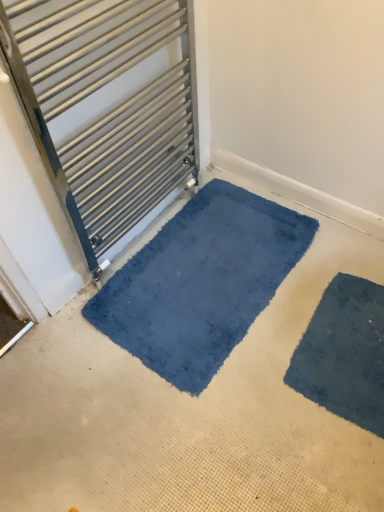
Question: Is satin silver towel rail at upper left inside the boundaries of blue plush mat at lower center, or outside?

Choices:
 (A) inside
 (B) outside

Answer: (B)

Question: Looking at their shapes, would you say satin silver towel rail at upper left is wider or thinner than blue plush mat at lower center?

Choices:
 (A) wide
 (B) thin

Answer: (B)

Question: Based on their relative distances, which object is nearer to the satin silver towel rail at upper left?

Choices:
 (A) blue plush mat at lower center
 (B) dark blue plush bath mat at lower right
 (C) blue soft carpet at center

Answer: (A)

Question: Which object is the closest to the blue soft carpet at center?

Choices:
 (A) dark blue plush bath mat at lower right
 (B) satin silver towel rail at upper left
 (C) blue plush mat at lower center

Answer: (C)